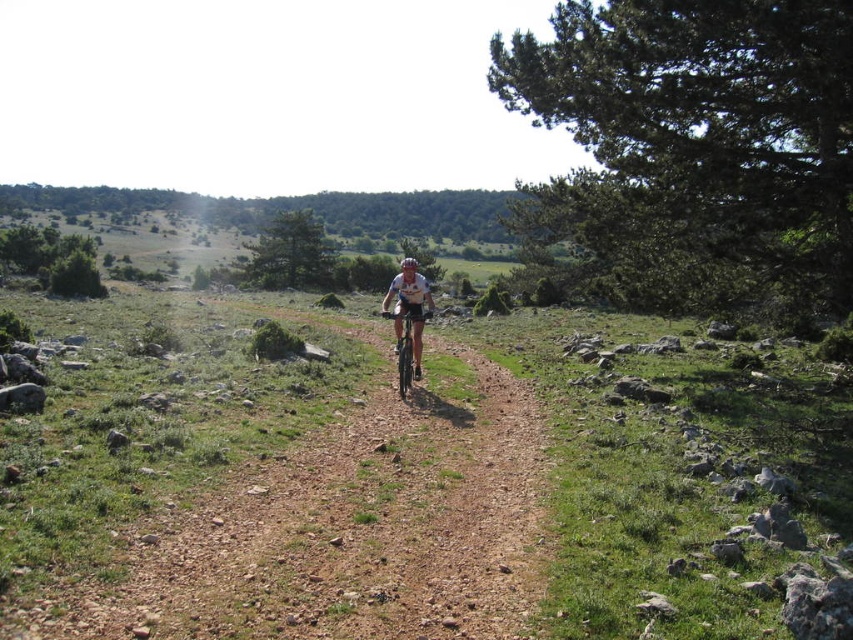
Question: Where is white matte bicycle at center located in relation to white matte bicycle helmet at center in the image?

Choices:
 (A) right
 (B) left

Answer: (A)

Question: Based on their relative distances, which object is farther from the white matte bicycle helmet at center?

Choices:
 (A) shiny metallic bicycle at center
 (B) white matte bicycle at center

Answer: (B)

Question: Among these objects, which one is farthest from the camera?

Choices:
 (A) shiny metallic bicycle at center
 (B) white matte bicycle at center

Answer: (B)

Question: Among these objects, which one is farthest from the camera?

Choices:
 (A) shiny metallic bicycle at center
 (B) white matte bicycle at center

Answer: (B)

Question: Does white matte bicycle at center have a smaller size compared to white matte bicycle helmet at center?

Choices:
 (A) no
 (B) yes

Answer: (B)

Question: Is white matte bicycle at center to the right of white matte bicycle helmet at center from the viewer's perspective?

Choices:
 (A) no
 (B) yes

Answer: (B)